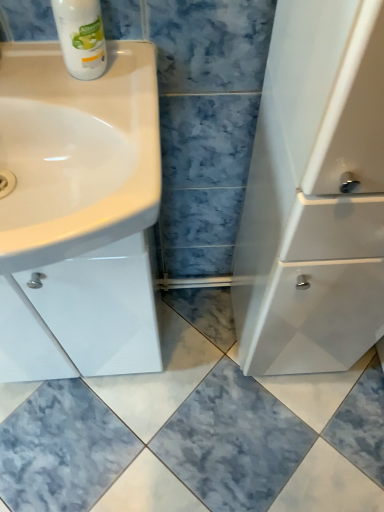
Question: Considering the relative positions of white glossy sink at left and white glossy bottle at upper left in the image provided, is white glossy sink at left to the right of white glossy bottle at upper left from the viewer's perspective?

Choices:
 (A) no
 (B) yes

Answer: (A)

Question: From a real-world perspective, is white glossy sink at left over white glossy bottle at upper left?

Choices:
 (A) yes
 (B) no

Answer: (B)

Question: From a real-world perspective, does white glossy sink at left sit lower than white glossy bottle at upper left?

Choices:
 (A) no
 (B) yes

Answer: (B)

Question: Are white glossy sink at left and white glossy bottle at upper left far apart?

Choices:
 (A) no
 (B) yes

Answer: (A)

Question: Is white glossy sink at left looking in the opposite direction of white glossy bottle at upper left?

Choices:
 (A) no
 (B) yes

Answer: (A)

Question: From the image's perspective, would you say white glossy sink at left is positioned over white glossy bottle at upper left?

Choices:
 (A) yes
 (B) no

Answer: (B)

Question: Is white glossy bottle at upper left far from white glossy sink at left?

Choices:
 (A) yes
 (B) no

Answer: (B)

Question: Considering the relative sizes of white glossy bottle at upper left and white glossy sink at left in the image provided, is white glossy bottle at upper left wider than white glossy sink at left?

Choices:
 (A) no
 (B) yes

Answer: (A)

Question: Is white glossy bottle at upper left smaller than white glossy sink at left?

Choices:
 (A) yes
 (B) no

Answer: (A)

Question: Is white glossy bottle at upper left not inside white glossy sink at left?

Choices:
 (A) no
 (B) yes

Answer: (B)

Question: From a real-world perspective, is white glossy bottle at upper left physically above white glossy sink at left?

Choices:
 (A) yes
 (B) no

Answer: (A)

Question: Is white glossy bottle at upper left to the left of white glossy sink at left from the viewer's perspective?

Choices:
 (A) yes
 (B) no

Answer: (B)

Question: From the image's perspective, relative to white glossy bottle at upper left, is white glossy sink at left above or below?

Choices:
 (A) above
 (B) below

Answer: (B)